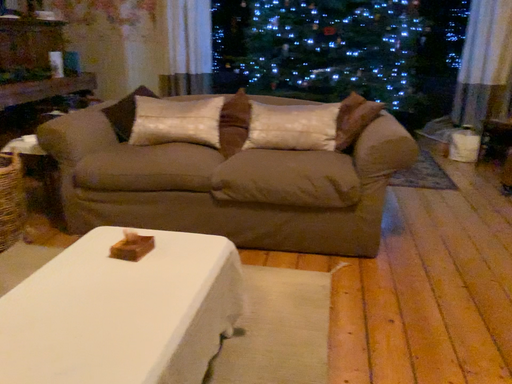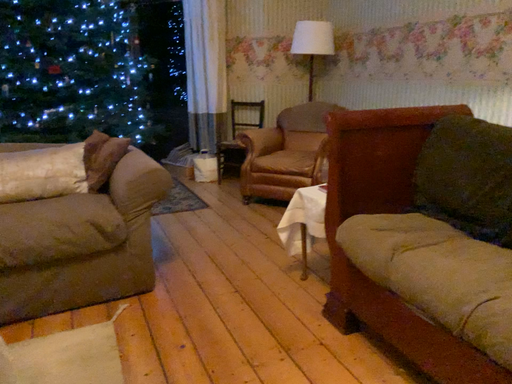
Question: Which way did the camera rotate in the video?

Choices:
 (A) rotated left
 (B) rotated right

Answer: (B)